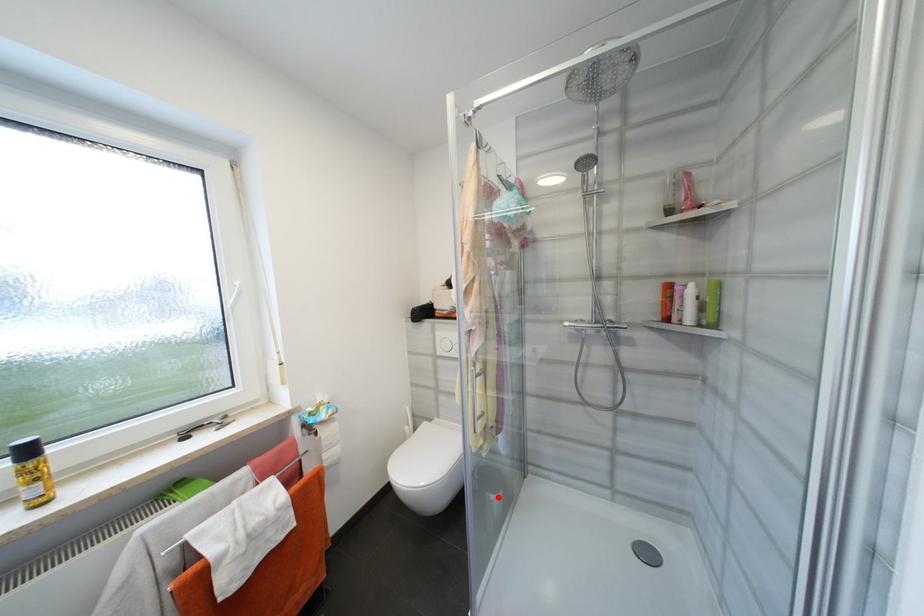
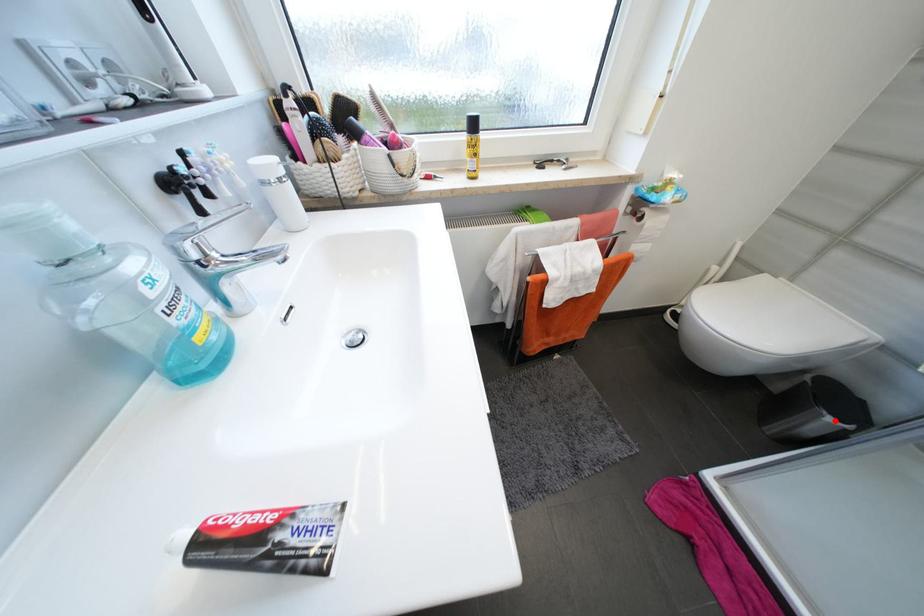
I am providing you with two images of the same scene from different viewpoints. A red point is marked on the first image and another point is marked on the second image. Is the red point in image1 aligned with the point shown in image2?

Yes